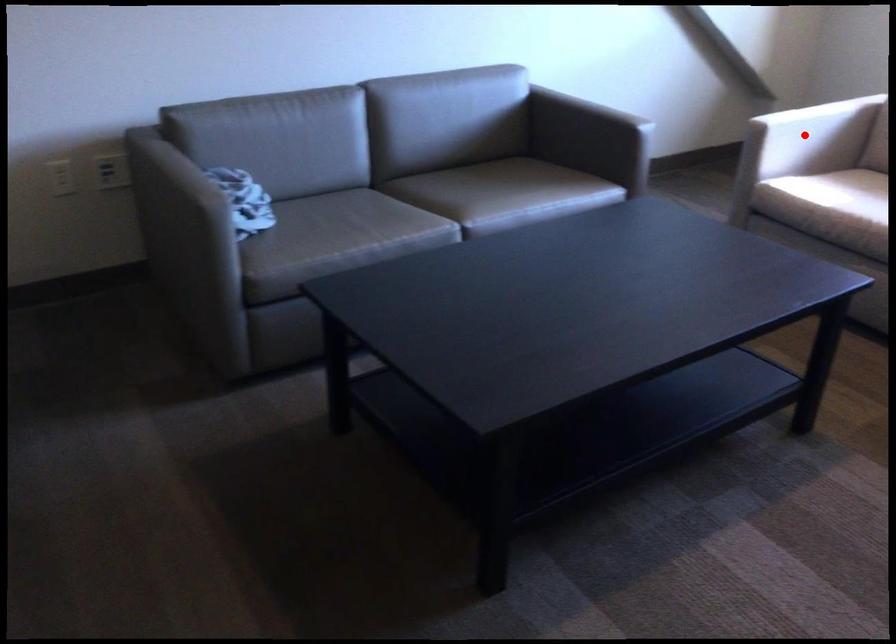
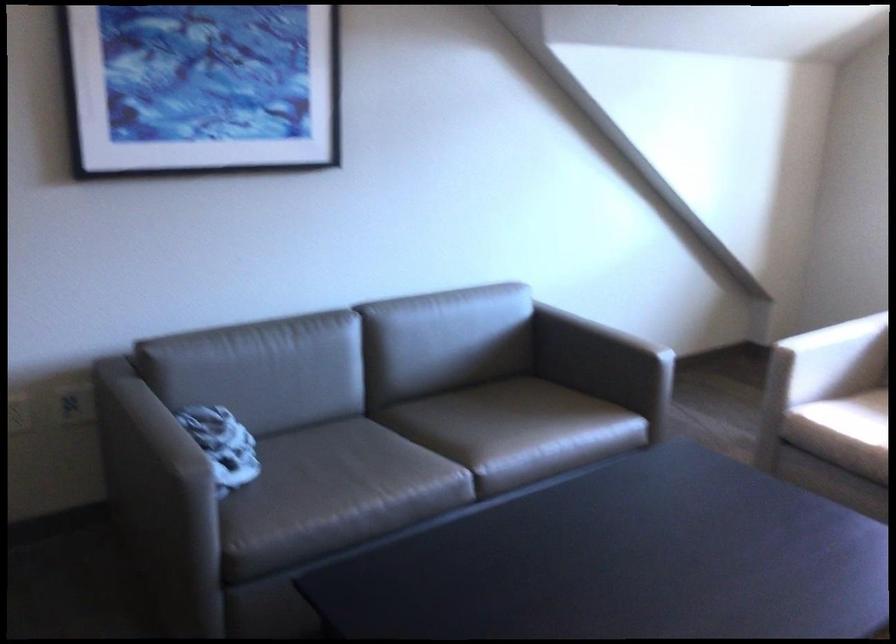
Where in the second image is the point corresponding to the highlighted location from the first image?

(831, 359)